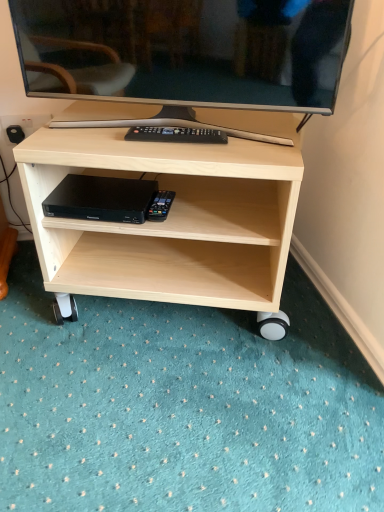
In order to face matte black television at upper center, should I rotate leftwards or rightwards?

Rotate your view left by about 2.816°.

Where is `matte black television at upper center`? This screenshot has height=512, width=384. matte black television at upper center is located at coordinates (185, 51).

Locate an element on the screen. The height and width of the screenshot is (512, 384). matte black television at upper center is located at coordinates (185, 51).

Is black plastic dvd player at lower center positioned with its back to matte black television at upper center?

No, matte black television at upper center is not at the back of black plastic dvd player at lower center.

Considering the sizes of objects black plastic dvd player at lower center and matte black television at upper center in the image provided, who is bigger, black plastic dvd player at lower center or matte black television at upper center?

matte black television at upper center is bigger.

From the image's perspective, which is above, black plastic dvd player at lower center or matte black television at upper center?

From the image's view, matte black television at upper center is above.

Can you tell me how much black plastic dvd player at lower center and matte black television at upper center differ in facing direction?

There is a 3.55-degree angle between the facing directions of black plastic dvd player at lower center and matte black television at upper center.

Which of these two, matte black television at upper center or black plastic dvd player at lower center, is smaller?

black plastic dvd player at lower center.

Between matte black television at upper center and black plastic dvd player at lower center, which one has more height?

matte black television at upper center is taller.

Is matte black television at upper center to the left or to the right of black plastic dvd player at lower center in the image?

matte black television at upper center is positioned on black plastic dvd player at lower center's right side.

Which object is further away from the camera taking this photo, matte black television at upper center or black plastic dvd player at lower center?

black plastic dvd player at lower center is behind.

From the picture: Who is bigger, light wood shelf at center or matte black television at upper center?

Bigger between the two is light wood shelf at center.

Is light wood shelf at center at the left side of matte black television at upper center?

Incorrect, light wood shelf at center is not on the left side of matte black television at upper center.

Is light wood shelf at center completely or partially outside of matte black television at upper center?

Yes.

In the image, is light wood shelf at center positioned in front of or behind matte black television at upper center?

Clearly, light wood shelf at center is behind matte black television at upper center.

From a real-world perspective, is black plastic dvd player at lower center located higher than light wood shelf at center?

Yes, from a real-world perspective, black plastic dvd player at lower center is on top of light wood shelf at center.

Can you confirm if black plastic dvd player at lower center is taller than light wood shelf at center?

Incorrect, the height of black plastic dvd player at lower center is not larger of that of light wood shelf at center.

Considering the sizes of objects black plastic dvd player at lower center and light wood shelf at center in the image provided, who is thinner, black plastic dvd player at lower center or light wood shelf at center?

With smaller width is black plastic dvd player at lower center.

Which of these two, matte black television at upper center or light wood shelf at center, is wider?

Wider between the two is light wood shelf at center.

Measure the distance between matte black television at upper center and light wood shelf at center.

matte black television at upper center is 9.05 inches from light wood shelf at center.

Is matte black television at upper center facing away from light wood shelf at center?

No, matte black television at upper center is not facing the opposite direction of light wood shelf at center.

Could light wood shelf at center be considered to be inside matte black television at upper center?

No, light wood shelf at center is located outside of matte black television at upper center.

What's the angular difference between light wood shelf at center and black plastic dvd player at lower center's facing directions?

There is a 0.000169-degree angle between the facing directions of light wood shelf at center and black plastic dvd player at lower center.

Between light wood shelf at center and black plastic dvd player at lower center, which one appears on the right side from the viewer's perspective?

Positioned to the right is light wood shelf at center.

From the image's perspective, is light wood shelf at center below black plastic dvd player at lower center?

Yes.

From a real-world perspective, is light wood shelf at center positioned above or below black plastic dvd player at lower center?

In terms of real-world spatial position, light wood shelf at center is below black plastic dvd player at lower center.

Image resolution: width=384 pixels, height=512 pixels. I want to click on television in front of the black plastic dvd player at lower center, so click(185, 51).

The height and width of the screenshot is (512, 384). What are the coordinates of `computer behind the matte black television at upper center` in the screenshot? It's located at (101, 199).

Estimate the real-world distances between objects in this image. Which object is closer to matte black television at upper center, black plastic dvd player at lower center or light wood shelf at center?

The object closer to matte black television at upper center is light wood shelf at center.

From the image, which object appears to be farther from matte black television at upper center, light wood shelf at center or black plastic dvd player at lower center?

black plastic dvd player at lower center lies further to matte black television at upper center than the other object.

From the picture: Considering their positions, is black plastic dvd player at lower center positioned closer to light wood shelf at center than matte black television at upper center?

black plastic dvd player at lower center is closer to light wood shelf at center.

Based on their spatial positions, is matte black television at upper center or black plastic dvd player at lower center closer to light wood shelf at center?

Based on the image, black plastic dvd player at lower center appears to be nearer to light wood shelf at center.

From the image, which object appears to be nearer to black plastic dvd player at lower center, matte black television at upper center or light wood shelf at center?

light wood shelf at center is positioned closer to the anchor black plastic dvd player at lower center.

Based on their spatial positions, is light wood shelf at center or matte black television at upper center further from black plastic dvd player at lower center?

matte black television at upper center is positioned further to the anchor black plastic dvd player at lower center.

Identify the location of computer between matte black television at upper center and light wood shelf at center in the up-down direction. Image resolution: width=384 pixels, height=512 pixels. pyautogui.click(x=101, y=199).